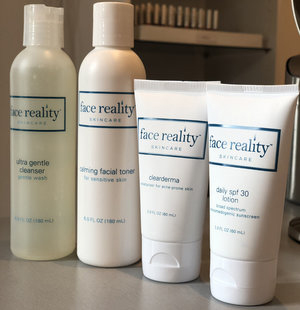
Locate an element on the screen. This screenshot has height=310, width=300. stainless steel canister is located at coordinates (294, 175).